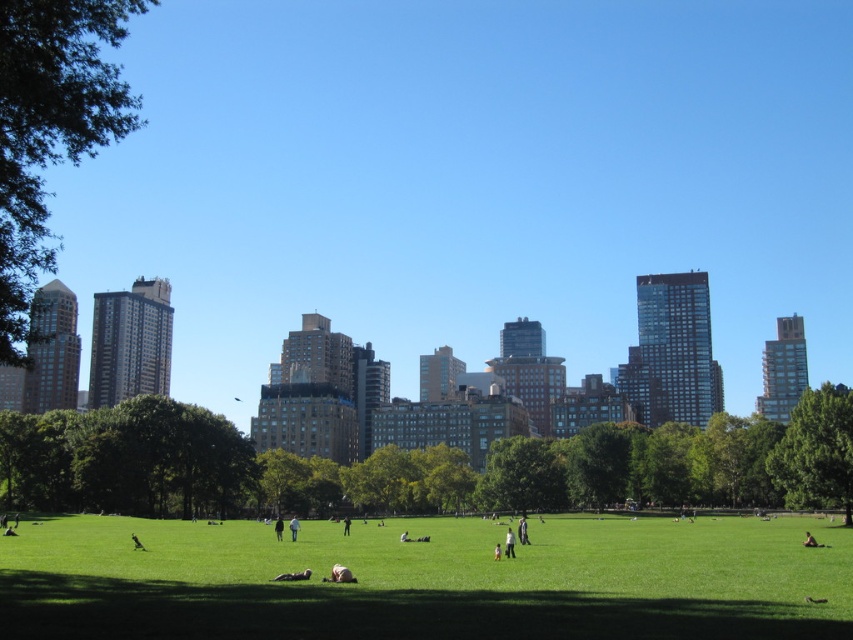
You are a photographer standing in the park and want to take a photo of both the light brown leather jacket at center and the dark brown leather jacket at center. Which jacket should you adjust your camera to focus on first if you want to capture them both clearly in the frame?

The light brown leather jacket at center is to the right of the dark brown leather jacket at center, so you should focus on the dark brown leather jacket at center first as it is closer to the left side of the frame, ensuring both jackets are within the camera view.